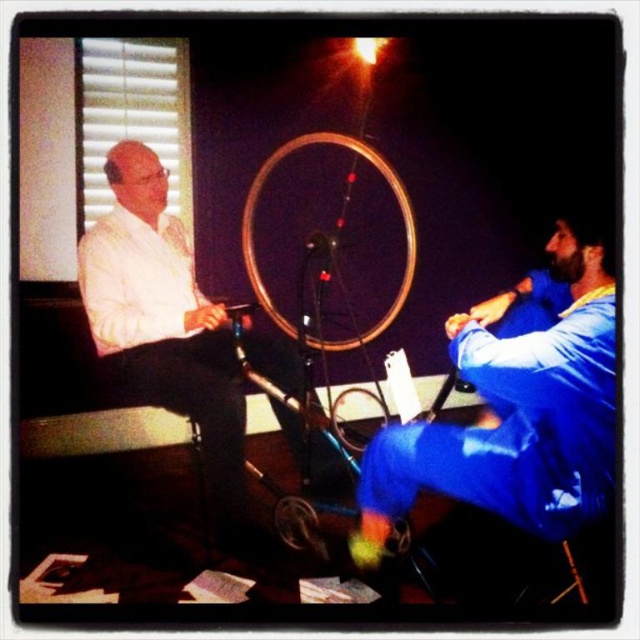
Question: Can you confirm if blue fabric pants at right is positioned to the left of wooden bicycle wheel at center?

Choices:
 (A) no
 (B) yes

Answer: (A)

Question: Estimate the real-world distances between objects in this image. Which object is closer to the blue fabric pants at right?

Choices:
 (A) wooden bicycle wheel at center
 (B) metallic gold bicycle wheel at center

Answer: (B)

Question: Among these objects, which one is nearest to the camera?

Choices:
 (A) metallic gold bicycle wheel at center
 (B) wooden bicycle wheel at center

Answer: (A)

Question: Considering the relative positions of blue fabric pants at right and white matte shirt at left in the image provided, where is blue fabric pants at right located with respect to white matte shirt at left?

Choices:
 (A) below
 (B) above

Answer: (A)

Question: Is blue fabric pants at right below wooden bicycle wheel at center?

Choices:
 (A) yes
 (B) no

Answer: (A)

Question: Which point is closer to the camera taking this photo?

Choices:
 (A) (115, 337)
 (B) (604, 476)
 (C) (336, 419)
 (D) (252, 276)

Answer: (B)